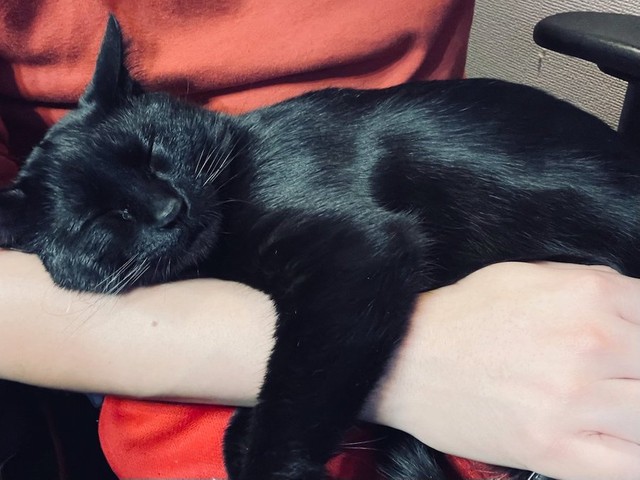
Identify the location of tan wall. (496, 17).